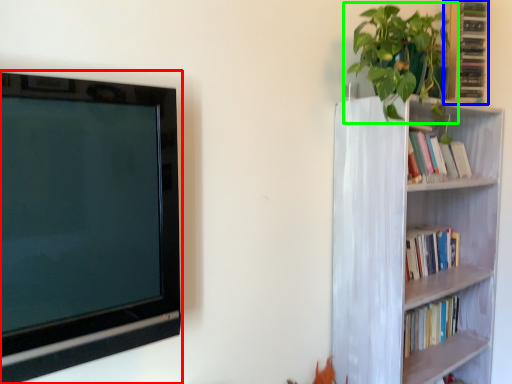
Question: Considering the real-world distances, which object is closest to television (highlighted by a red box)? cabinet (highlighted by a blue box) or houseplant (highlighted by a green box).

Choices:
 (A) cabinet
 (B) houseplant

Answer: (B)